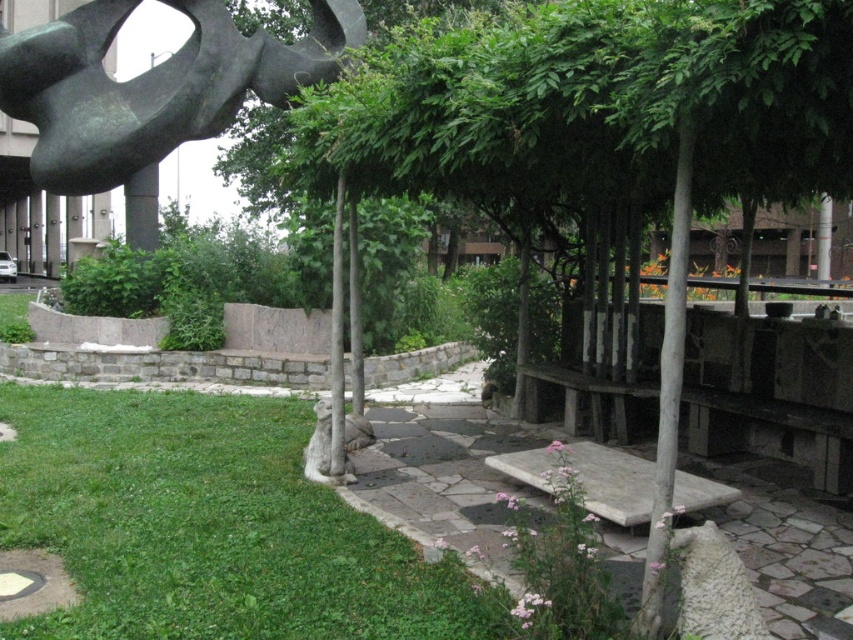
You are standing at the entrance of the garden and want to find the bronze sculpture at upper left. According to the garden layout, where should you look relative to your current position?

The bronze sculpture at upper left is located at point [151,84], which means it is positioned towards the upper left direction from your current position at the entrance.

You are a gardener planning to place a new decorative pot in the garden. You want it to be visible from the bronze sculpture at upper left but not blocked by the green grass at lower left. Where should you position the pot?

Place the decorative pot above the green grass at lower left, near the bronze sculpture at upper left to ensure visibility without obstruction from the grass.